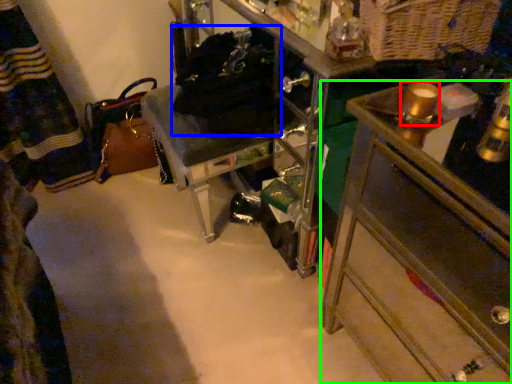
Question: Estimate the real-world distances between objects in this image. Which object is closer to beverage (highlighted by a red box), laundry (highlighted by a blue box) or chest of drawers (highlighted by a green box)?

Choices:
 (A) laundry
 (B) chest of drawers

Answer: (B)